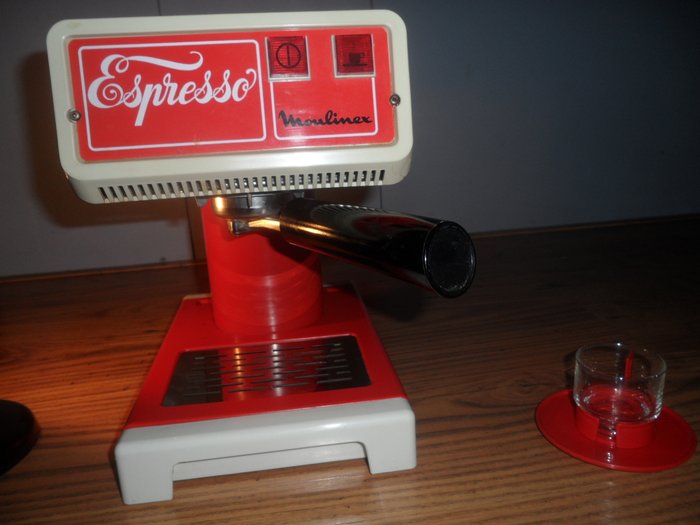
At what (x,y) coordinates should I click in order to perform the action: click on vent. Please return your answer as a coordinate pair (x, y). Looking at the image, I should click on (323, 180).